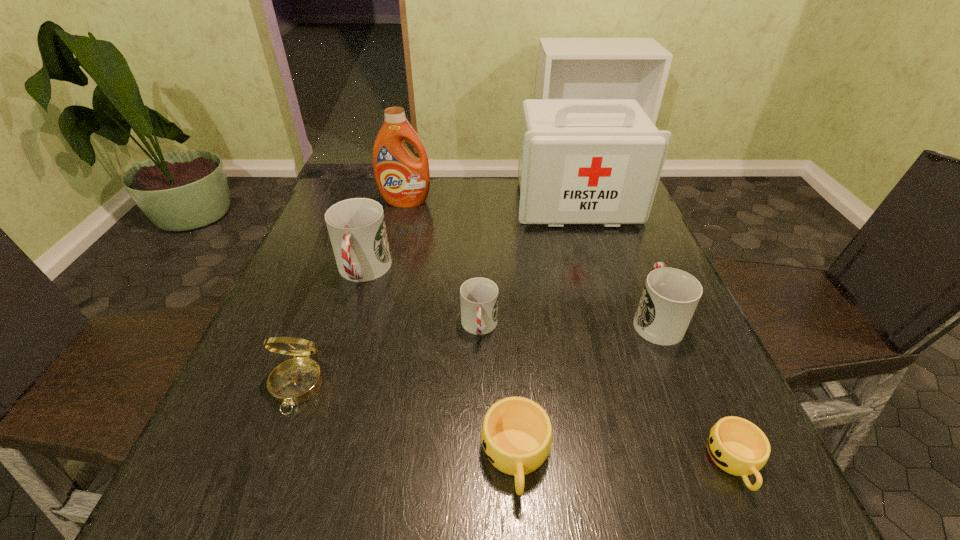
In order to click on object located at the far right corner in this screenshot , I will do `click(581, 161)`.

Identify the location of object at the near right corner. This screenshot has height=540, width=960. (x=736, y=445).

In the image, there is a desktop. Identify the location of vacant space at the near edge. Image resolution: width=960 pixels, height=540 pixels. (x=399, y=464).

Find the location of a particular element. Image resolution: width=960 pixels, height=540 pixels. free space at the left edge is located at coordinates (347, 285).

In the image, there is a desktop. In order to click on vacant space at the right edge in this screenshot , I will do `click(600, 233)`.

In the image, there is a desktop. Find the location of `vacant space at the far left corner`. vacant space at the far left corner is located at coordinates (334, 198).

Where is `vacant region at the near right corner`? This screenshot has width=960, height=540. vacant region at the near right corner is located at coordinates (684, 471).

I want to click on vacant region between the shortest cup and the tallest cup, so click(548, 367).

Where is `unoccupied position between the shortest object and the detergent`? unoccupied position between the shortest object and the detergent is located at coordinates (570, 332).

Where is `vacant area between the second biggest red cup and the second red cup from left to right`? vacant area between the second biggest red cup and the second red cup from left to right is located at coordinates (567, 323).